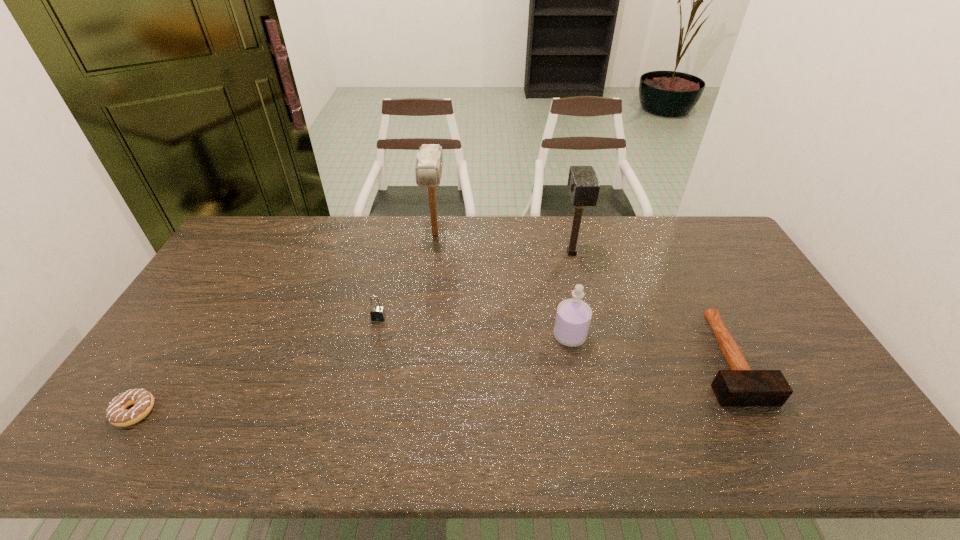
At what (x,y) coordinates should I click in order to perform the action: click on vacant area at the near edge of the desktop. Please return your answer as a coordinate pair (x, y). Looking at the image, I should click on (730, 432).

This screenshot has height=540, width=960. Find the location of `blank space at the left edge`. blank space at the left edge is located at coordinates (169, 362).

You are a GUI agent. You are given a task and a screenshot of the screen. Output one action in this format:
    pyautogui.click(x=<x>, y=<y>)
    Task: Click on the vacant space at the right edge of the desktop
    The image size is (960, 540).
    Given the screenshot: What is the action you would take?
    pyautogui.click(x=838, y=420)

You are a GUI agent. You are given a task and a screenshot of the screen. Output one action in this format:
    pyautogui.click(x=<x>, y=<y>)
    Task: Click on the free region at the far left corner of the desktop
    Image resolution: width=960 pixels, height=540 pixels.
    Given the screenshot: What is the action you would take?
    pyautogui.click(x=280, y=220)

This screenshot has height=540, width=960. In order to click on vacant position at the near left corner of the desktop in this screenshot , I will do `click(101, 447)`.

The image size is (960, 540). What are the coordinates of `free region at the far right corner of the desktop` in the screenshot? It's located at (708, 219).

I want to click on vacant space that is in between the second mallet from left to right and the padlock, so click(475, 286).

I want to click on vacant area between the third shortest object and the leftmost object, so click(256, 364).

I want to click on vacant area that lies between the perfume and the second mallet from left to right, so click(x=570, y=294).

I want to click on unoccupied position between the second mallet from left to right and the nearest mallet, so click(x=649, y=306).